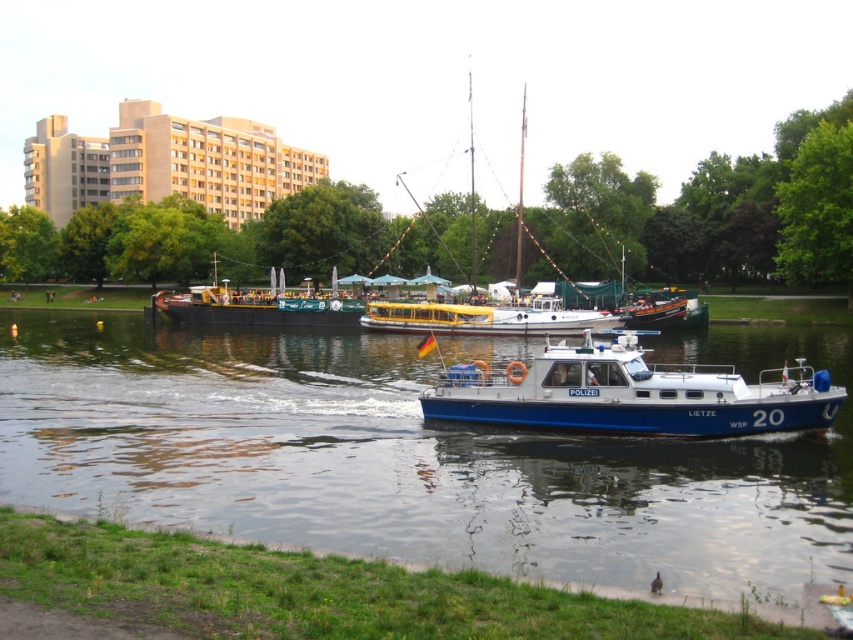
You are a photographer trying to capture both the blue metallic boat at center and the yellow matte boat at center in a single shot. Based on their positions, which boat would appear closer to the camera in your photo?

The blue metallic boat at center appears closer to the camera because it is positioned in front of the yellow matte boat at center.

You are standing on the riverside bank and want to board the blue metallic boat at center and the yellow matte boat at center. Which boat is closer to you?

The blue metallic boat at center is 10.81 meters away from the yellow matte boat at center, so the distance between them is 10.81 meters. However, without knowing your exact position relative to both boats, I cannot determine which one is closer to you.

You are a photographer planning to take a picture of the blue metallic police boat at center and the green canvas barge at center. Since you want to ensure both are in focus, you need to know their vertical positions. Can you tell me which one is lower in the image?

The blue metallic police boat at center is located below the green canvas barge at center, so it is lower in the image.